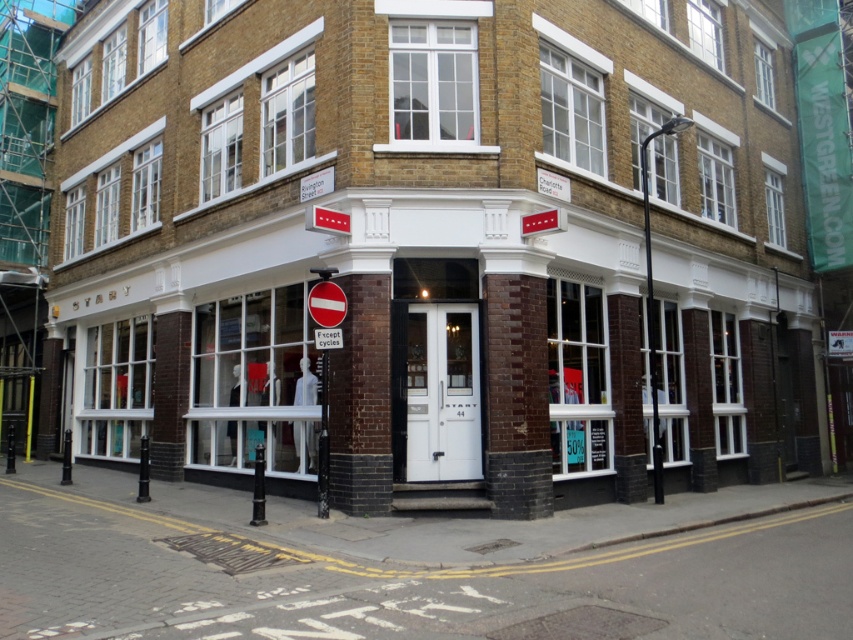
You are a delivery person trying to secure a package on the roof of your vehicle. The package requires a pole that is at least 2 meters tall to stabilize it. You have two poles available in the scene, the black metal pole at upper right and the metallic pole at center. Which pole should you choose?

The metallic pole at center is taller than the black metal pole at upper right, so you should choose the metallic pole at center to stabilize the package since it meets the height requirement.

You are a city planner assessing the width of poles in the image. The black metal pole at upper right and the metallic pole at center are both in view. Which pole has a greater width?

The black metal pole at upper right has a greater width than the metallic pole at center.